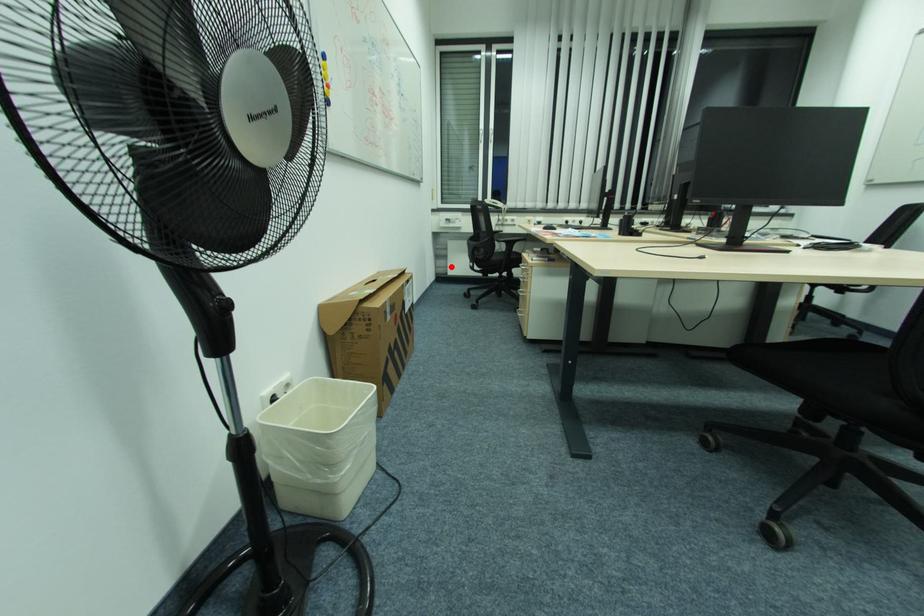
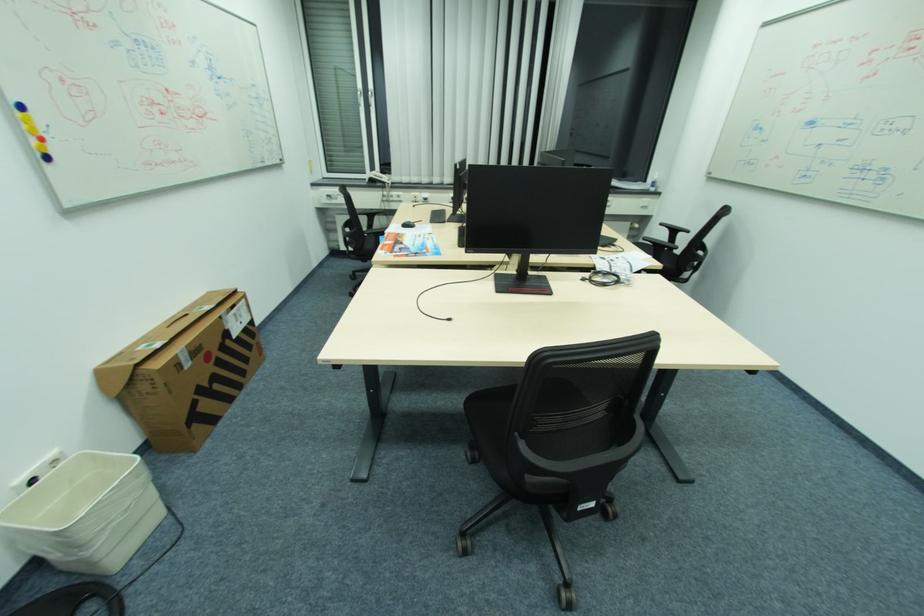
Locate, in the second image, the point that corresponds to the highlighted location in the first image.

(343, 241)